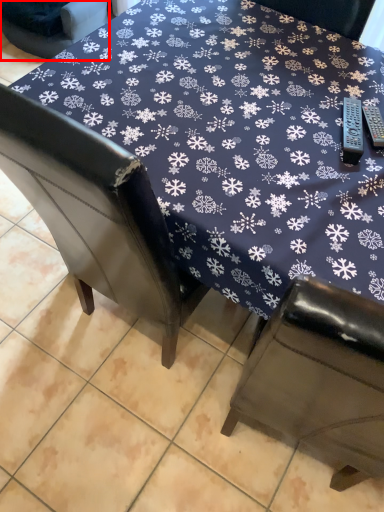
Question: From the image, what is the correct spatial relationship of chair (annotated by the red box) in relation to table?

Choices:
 (A) right
 (B) left

Answer: (B)